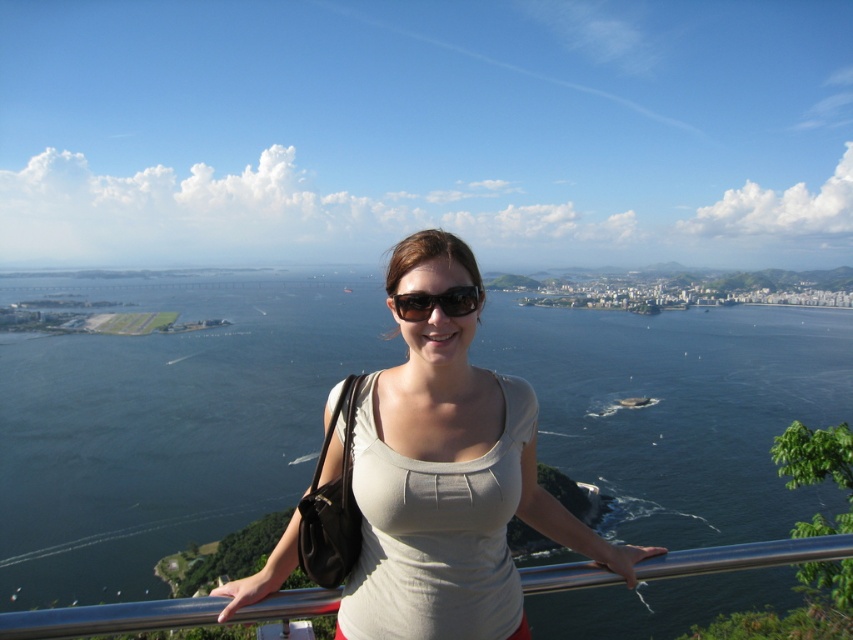
You are standing at the point marked by the coordinates point (280,609) and want to walk towards the city in the background. Is the point marked by point (473,289) in your path?

Yes, the point marked by point (473,289) is in your path because point (280,609) is in front of point (473,289), meaning the latter is behind the former along the line of sight towards the city.

You are a photographer trying to capture the scenic view of the dark blue water at center and the black plastic sunglasses at center. Which object appears taller in the photo?

The dark blue water at center appears taller than the black plastic sunglasses at center in the photo.